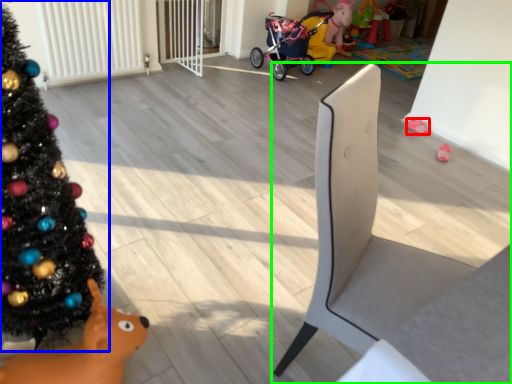
Question: Estimate the real-world distances between objects in this image. Which object is farther from toy (highlighted by a red box), christmas tree (highlighted by a blue box) or furniture (highlighted by a green box)?

Choices:
 (A) christmas tree
 (B) furniture

Answer: (A)